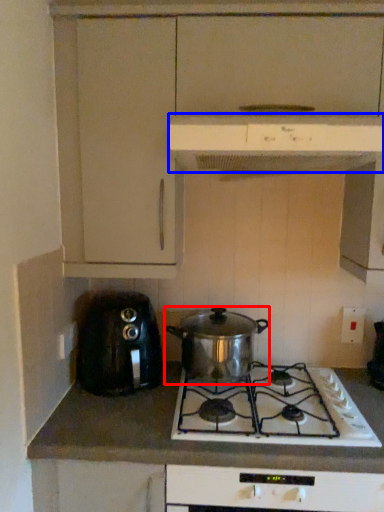
Question: Which object appears farthest to the camera in this image, kitchen appliance (highlighted by a red box) or kitchen appliance (highlighted by a blue box)?

Choices:
 (A) kitchen appliance
 (B) kitchen appliance

Answer: (A)